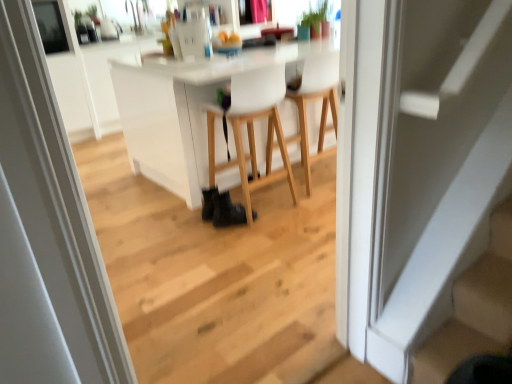
Question: From a real-world perspective, relative to white matte chair at center, placed as the first chair when sorted from right to left, is white matte chair at center, the second chair viewed from the right, vertically above or below?

Choices:
 (A) below
 (B) above

Answer: (B)

Question: Relative to white matte chair at center, placed as the first chair when sorted from right to left, is white matte chair at center, the 1th chair positioned from the left, in front or behind?

Choices:
 (A) front
 (B) behind

Answer: (A)

Question: Which object is positioned farthest from the white matte chair at center, acting as the second chair starting from the left?

Choices:
 (A) white glossy door at center
 (B) white matte stair at lower right
 (C) black leather shoe at lower center
 (D) white matte chair at center, the 1th chair positioned from the left

Answer: (A)

Question: Estimate the real-world distances between objects in this image. Which object is farther from the white glossy door at center?

Choices:
 (A) black leather shoe at lower center
 (B) white matte stair at lower right
 (C) white matte chair at center, the 1th chair positioned from the left
 (D) white matte chair at center, acting as the second chair starting from the left

Answer: (D)